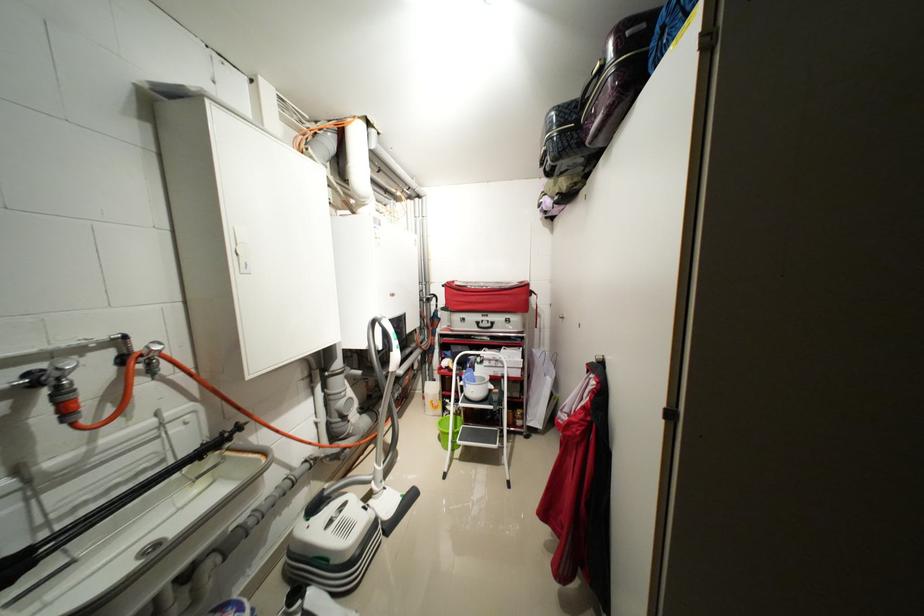
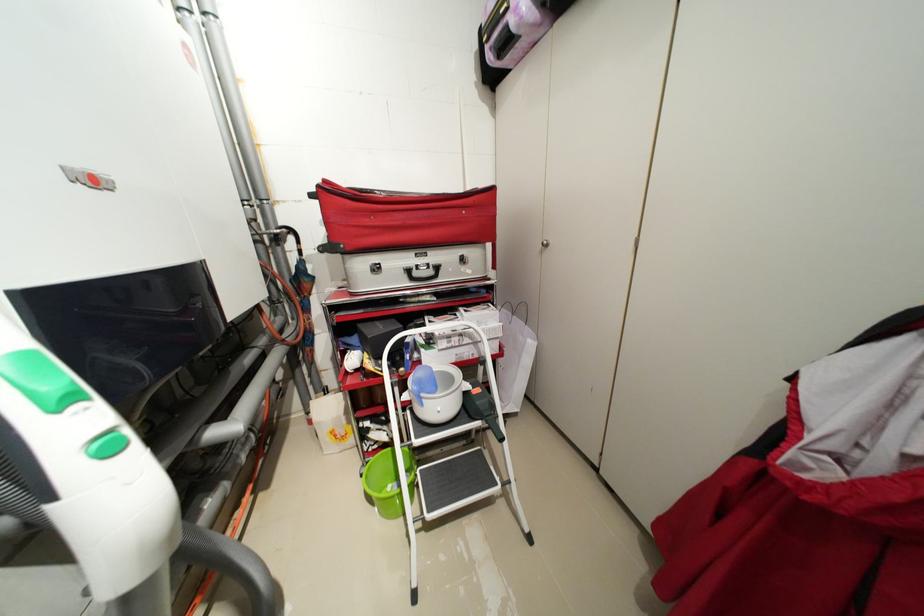
Where in the second image is the point corresponding to (468,384) from the first image?

(412, 398)